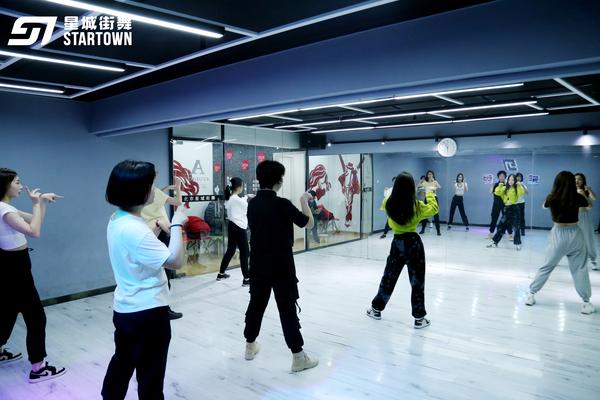
Find the location of a particular element. The height and width of the screenshot is (400, 600). reflection of floor is located at coordinates (466, 250).